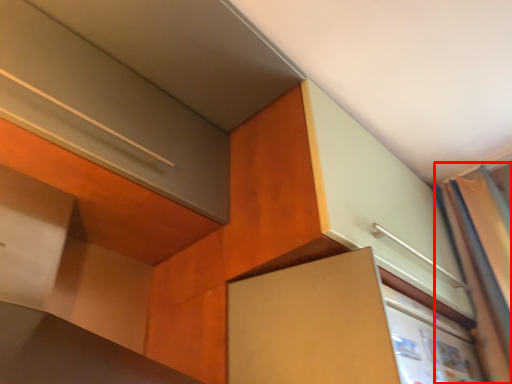
Question: From the image's perspective, what is the correct spatial relationship of curtain (annotated by the red box) in relation to cabinetry?

Choices:
 (A) below
 (B) above

Answer: (B)